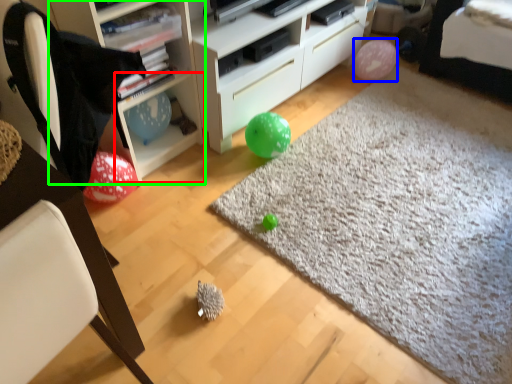
Question: Which object is positioned farthest from cabinet (highlighted by a red box)? Select from balloon (highlighted by a blue box) and shelf (highlighted by a green box).

Choices:
 (A) balloon
 (B) shelf

Answer: (A)